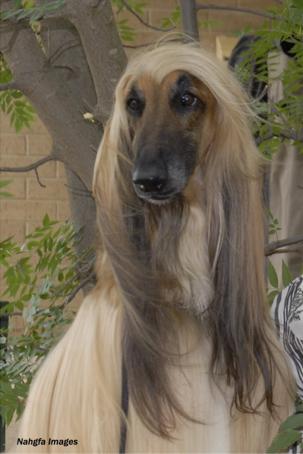
Locate an element on the screen. The height and width of the screenshot is (454, 303). brick wall is located at coordinates (36, 192).